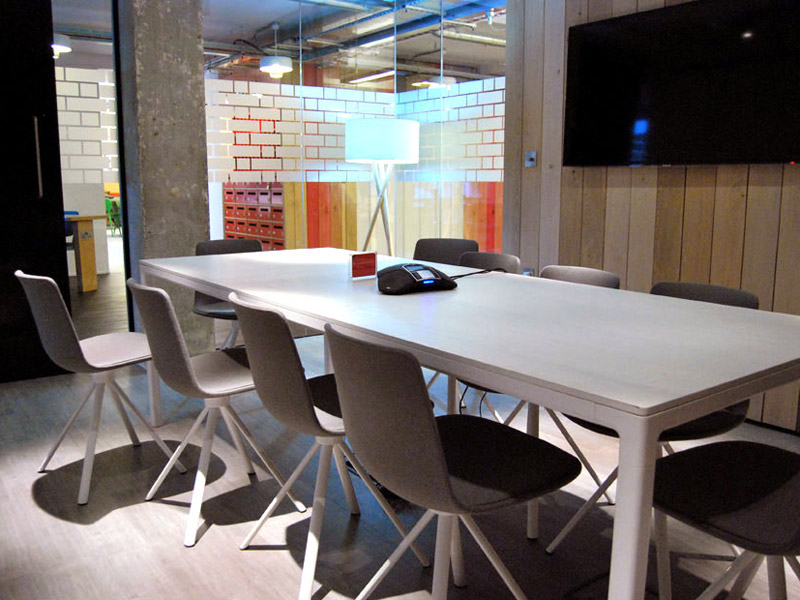
You are a GUI agent. You are given a task and a screenshot of the screen. Output one action in this format:
    pyautogui.click(x=<x>, y=<y>)
    Task: Click on the room lamp
    The width and height of the screenshot is (800, 600).
    Given the screenshot: What is the action you would take?
    pyautogui.click(x=389, y=144)